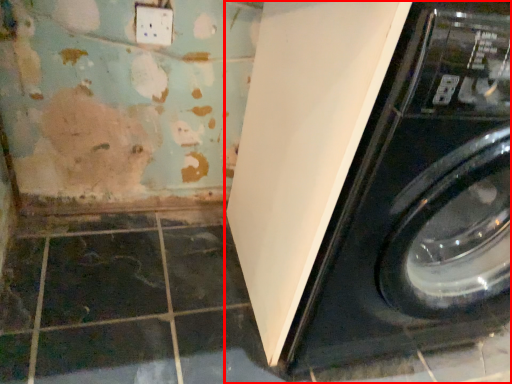
Question: From the image's perspective, what is the correct spatial positioning of washing machine (annotated by the red box) in reference to electric outlet?

Choices:
 (A) above
 (B) below

Answer: (B)